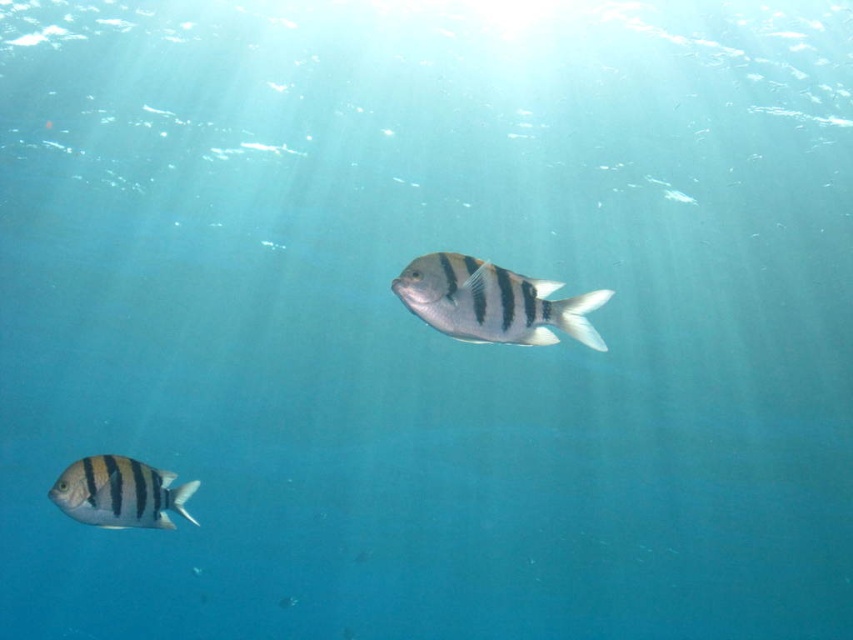
Question: Which object is closer to the camera taking this photo?

Choices:
 (A) silver metallic fish at center
 (B) striped matte fish at lower left

Answer: (A)

Question: Is the position of silver metallic fish at center less distant than that of striped matte fish at lower left?

Choices:
 (A) yes
 (B) no

Answer: (A)

Question: Is silver metallic fish at center thinner than striped matte fish at lower left?

Choices:
 (A) no
 (B) yes

Answer: (B)

Question: Does silver metallic fish at center appear over striped matte fish at lower left?

Choices:
 (A) yes
 (B) no

Answer: (A)

Question: Which object appears farthest from the camera in this image?

Choices:
 (A) silver metallic fish at center
 (B) striped matte fish at lower left

Answer: (B)

Question: Among these points, which one is nearest to the camera?

Choices:
 (A) pyautogui.click(x=508, y=282)
 (B) pyautogui.click(x=120, y=516)

Answer: (A)